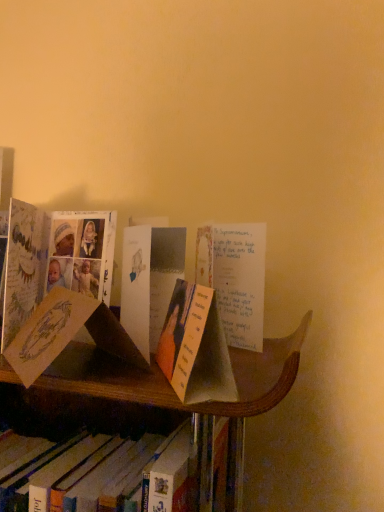
Question: Is orange paper bookmark at center, the second book in the bottom-to-top sequence, smaller than white paper bookmark at center, positioned as the first book in left-to-right order?

Choices:
 (A) no
 (B) yes

Answer: (B)

Question: Is orange paper bookmark at center, which appears as the 1th book when viewed from the right, oriented away from white paper bookmark at center, which appears as the 1th book when ordered from the bottom?

Choices:
 (A) no
 (B) yes

Answer: (A)

Question: Is orange paper bookmark at center, the second book in the bottom-to-top sequence, in contact with white paper bookmark at center, marked as the 2th book in a top-to-bottom arrangement?

Choices:
 (A) no
 (B) yes

Answer: (A)

Question: Would you say white paper bookmark at center, which appears as the 1th book when ordered from the bottom, is part of orange paper bookmark at center, which appears as the 1th book when viewed from the right,'s contents?

Choices:
 (A) no
 (B) yes

Answer: (A)

Question: From a real-world perspective, is orange paper bookmark at center, the first book positioned from the top, physically above white paper bookmark at center, marked as the 2th book in a top-to-bottom arrangement?

Choices:
 (A) yes
 (B) no

Answer: (A)

Question: Is orange paper bookmark at center, the first book positioned from the top, shorter than white paper bookmark at center, marked as the 2th book in a top-to-bottom arrangement?

Choices:
 (A) yes
 (B) no

Answer: (A)

Question: Does white paper bookmark at center, positioned as the first book in left-to-right order, lie behind orange paper bookmark at center, the 2th book from the left?

Choices:
 (A) yes
 (B) no

Answer: (A)

Question: Does white paper bookmark at center, positioned as the first book in left-to-right order, have a smaller size compared to orange paper bookmark at center, the second book in the bottom-to-top sequence?

Choices:
 (A) no
 (B) yes

Answer: (A)

Question: Can you confirm if white paper bookmark at center, the second book from the right, is positioned to the left of orange paper bookmark at center, which appears as the 1th book when viewed from the right?

Choices:
 (A) no
 (B) yes

Answer: (B)

Question: Is white paper bookmark at center, positioned as the first book in left-to-right order, closer to camera compared to orange paper bookmark at center, the 2th book from the left?

Choices:
 (A) no
 (B) yes

Answer: (A)

Question: Is white paper bookmark at center, the second book from the right, shorter than orange paper bookmark at center, which appears as the 1th book when viewed from the right?

Choices:
 (A) no
 (B) yes

Answer: (A)

Question: Considering the relative sizes of white paper bookmark at center, the second book from the right, and orange paper bookmark at center, which appears as the 1th book when viewed from the right, in the image provided, is white paper bookmark at center, the second book from the right, taller than orange paper bookmark at center, which appears as the 1th book when viewed from the right,?

Choices:
 (A) no
 (B) yes

Answer: (B)

Question: Which is correct: white paper bookmark at center, marked as the 2th book in a top-to-bottom arrangement, is inside orange paper bookmark at center, the first book positioned from the top, or outside of it?

Choices:
 (A) outside
 (B) inside

Answer: (A)